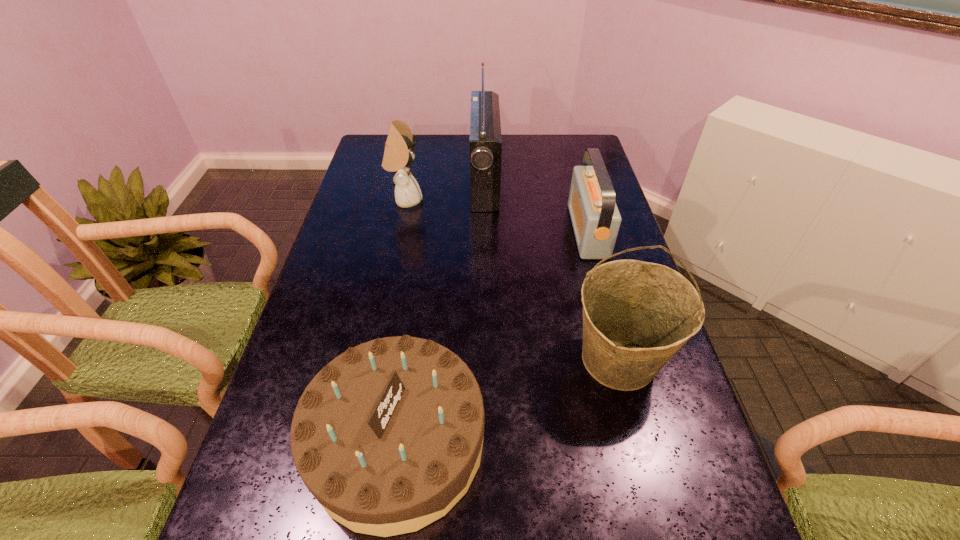
I want to click on vacant area situated 0.130m at the front face of the third shortest object, so click(x=463, y=200).

This screenshot has width=960, height=540. I want to click on vacant space situated on the front-facing side of the fourth tallest object, so click(x=546, y=231).

Locate an element on the screen. The image size is (960, 540). vacant space located 0.200m on the front-facing side of the fourth tallest object is located at coordinates (507, 231).

Locate an element on the screen. vacant space positioned on the front-facing side of the fourth tallest object is located at coordinates (477, 231).

The image size is (960, 540). In order to click on free location located on the front-facing side of the birthday cake in this screenshot , I will do pos(540,442).

Identify the location of object present at the far edge. (485, 141).

Find the location of a particular element. The height and width of the screenshot is (540, 960). doll that is at the left edge is located at coordinates 398,155.

Locate an element on the screen. The height and width of the screenshot is (540, 960). birthday cake present at the left edge is located at coordinates (388, 436).

The image size is (960, 540). Identify the location of wine bucket that is at the right edge. (636, 315).

Locate an element on the screen. radio receiver at the right edge is located at coordinates (595, 217).